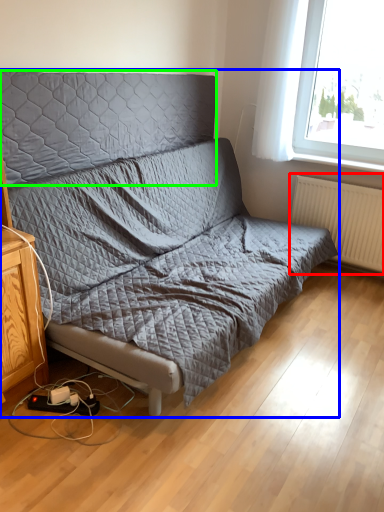
Question: Which object is the closest to the radiator (highlighted by a red box)? Choose among these: studio couch (highlighted by a blue box) or headboard (highlighted by a green box).

Choices:
 (A) studio couch
 (B) headboard

Answer: (A)